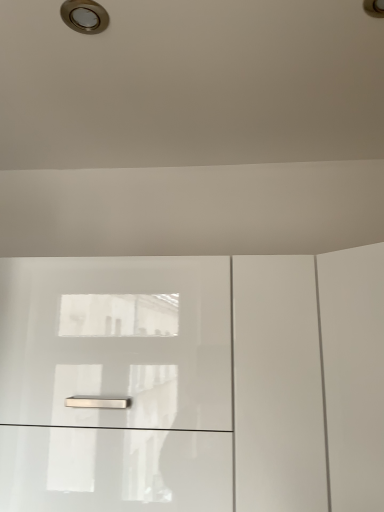
The height and width of the screenshot is (512, 384). What do you see at coordinates (186, 380) in the screenshot?
I see `glossy white cabinet at center` at bounding box center [186, 380].

What are the coordinates of `glossy white cabinet at center` in the screenshot? It's located at (186, 380).

Identify the location of brushed metal droplight at upper left. (84, 16).

The height and width of the screenshot is (512, 384). Describe the element at coordinates (84, 16) in the screenshot. I see `brushed metal droplight at upper left` at that location.

Locate an element on the screen. This screenshot has height=512, width=384. glossy white cabinet at center is located at coordinates (186, 380).

Does brushed metal droplight at upper left appear on the right side of glossy white cabinet at center?

Incorrect, brushed metal droplight at upper left is not on the right side of glossy white cabinet at center.

Is brushed metal droplight at upper left further to camera compared to glossy white cabinet at center?

No.

Which is closer to the camera, (78, 15) or (335, 348)?

Point (78, 15) is closer to the camera than point (335, 348).

From the image's perspective, who appears lower, brushed metal droplight at upper left or glossy white cabinet at center?

glossy white cabinet at center.

Based on the photo, from a real-world perspective, which is physically below, brushed metal droplight at upper left or glossy white cabinet at center?

In real-world perspective, glossy white cabinet at center is lower.

Based on the photo, is brushed metal droplight at upper left thinner than glossy white cabinet at center?

Correct, the width of brushed metal droplight at upper left is less than that of glossy white cabinet at center.

From the picture: Can you confirm if brushed metal droplight at upper left is taller than glossy white cabinet at center?

No.

Between brushed metal droplight at upper left and glossy white cabinet at center, which one has smaller size?

brushed metal droplight at upper left is smaller.

Does brushed metal droplight at upper left contain glossy white cabinet at center?

Definitely not — glossy white cabinet at center is not inside brushed metal droplight at upper left.

Is brushed metal droplight at upper left not close to glossy white cabinet at center?

Actually, brushed metal droplight at upper left and glossy white cabinet at center are a little close together.

Does brushed metal droplight at upper left turn towards glossy white cabinet at center?

No.

What's the angular difference between brushed metal droplight at upper left and glossy white cabinet at center's facing directions?

0.452 degrees.

In order to click on droplight on the left side of glossy white cabinet at center in this screenshot , I will do `click(84, 16)`.

Between glossy white cabinet at center and brushed metal droplight at upper left, which one appears on the right side from the viewer's perspective?

Positioned to the right is glossy white cabinet at center.

Is glossy white cabinet at center in front of or behind brushed metal droplight at upper left in the image?

Visually, glossy white cabinet at center is located behind brushed metal droplight at upper left.

Does point (302, 268) lie behind point (95, 18)?

Yes, it is.

In the scene shown: From the image's perspective, is glossy white cabinet at center positioned above or below brushed metal droplight at upper left?

glossy white cabinet at center is below brushed metal droplight at upper left.

From a real-world perspective, is glossy white cabinet at center beneath brushed metal droplight at upper left?

Yes.

Which object is wider, glossy white cabinet at center or brushed metal droplight at upper left?

With larger width is glossy white cabinet at center.

Considering the relative sizes of glossy white cabinet at center and brushed metal droplight at upper left in the image provided, is glossy white cabinet at center taller than brushed metal droplight at upper left?

Yes, glossy white cabinet at center is taller than brushed metal droplight at upper left.

Between glossy white cabinet at center and brushed metal droplight at upper left, which one has larger size?

Bigger between the two is glossy white cabinet at center.

Is brushed metal droplight at upper left located within glossy white cabinet at center?

No, brushed metal droplight at upper left is not a part of glossy white cabinet at center.

Is glossy white cabinet at center beside brushed metal droplight at upper left?

No.

Is glossy white cabinet at center oriented towards brushed metal droplight at upper left?

No, glossy white cabinet at center does not turn towards brushed metal droplight at upper left.

How many degrees apart are the facing directions of glossy white cabinet at center and brushed metal droplight at upper left?

0.452 degrees separate the facing orientations of glossy white cabinet at center and brushed metal droplight at upper left.

How much distance is there between glossy white cabinet at center and brushed metal droplight at upper left?

31.01 inches.

This screenshot has width=384, height=512. Identify the location of droplight that is above the glossy white cabinet at center (from the image's perspective). (84, 16).

This screenshot has width=384, height=512. I want to click on dresser below the brushed metal droplight at upper left (from the image's perspective), so click(x=186, y=380).

The width and height of the screenshot is (384, 512). Identify the location of droplight on the left of glossy white cabinet at center. (84, 16).